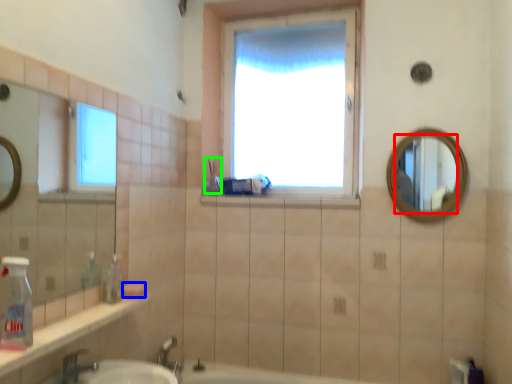
Question: Considering the real-world distances, which object is closest to mirror (highlighted by a red box)? soap (highlighted by a blue box) or toiletry (highlighted by a green box).

Choices:
 (A) soap
 (B) toiletry

Answer: (B)